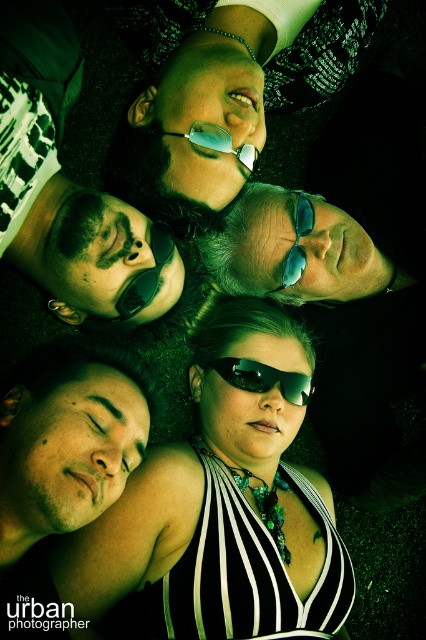
Question: Can you confirm if black plastic sunglasses at center is bigger than matte black sunglasses at upper center?

Choices:
 (A) yes
 (B) no

Answer: (A)

Question: Which of the following is the closest to the observer?

Choices:
 (A) (129, 410)
 (B) (207, 134)
 (C) (285, 272)

Answer: (B)

Question: Which object is the closest to the sunglasses at center?

Choices:
 (A) matte blue goggles at upper center
 (B) matte black sunglasses at upper center
 (C) matte black sunglasses at upper left

Answer: (A)

Question: Is matte blue goggles at upper center above sunglasses at center?

Choices:
 (A) no
 (B) yes

Answer: (B)

Question: Is black striped tank top at center smaller than matte black face at lower left?

Choices:
 (A) no
 (B) yes

Answer: (A)

Question: Which object appears farthest from the camera in this image?

Choices:
 (A) matte blue goggles at upper center
 (B) matte black sunglasses at upper left
 (C) matte black face at lower left
 (D) black plastic sunglasses at center

Answer: (D)